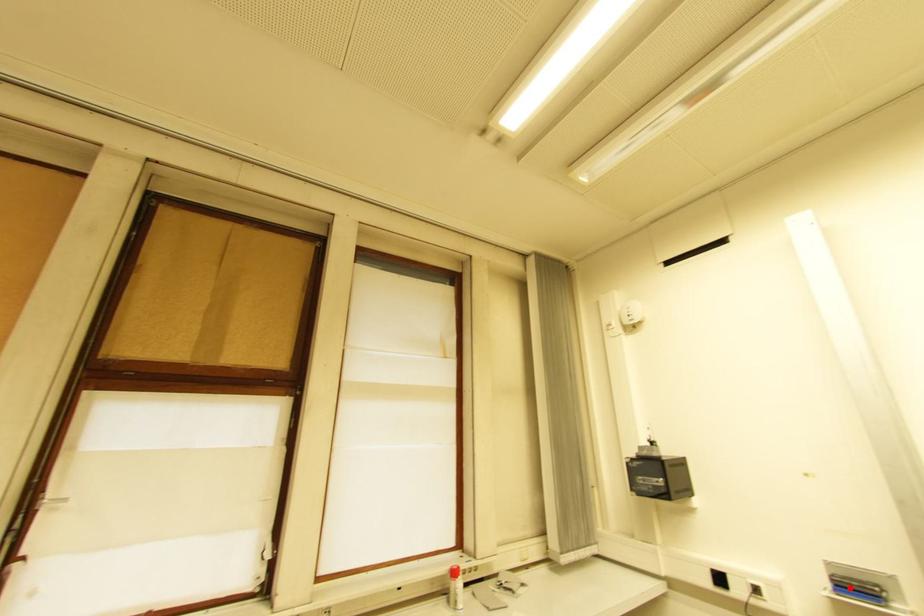
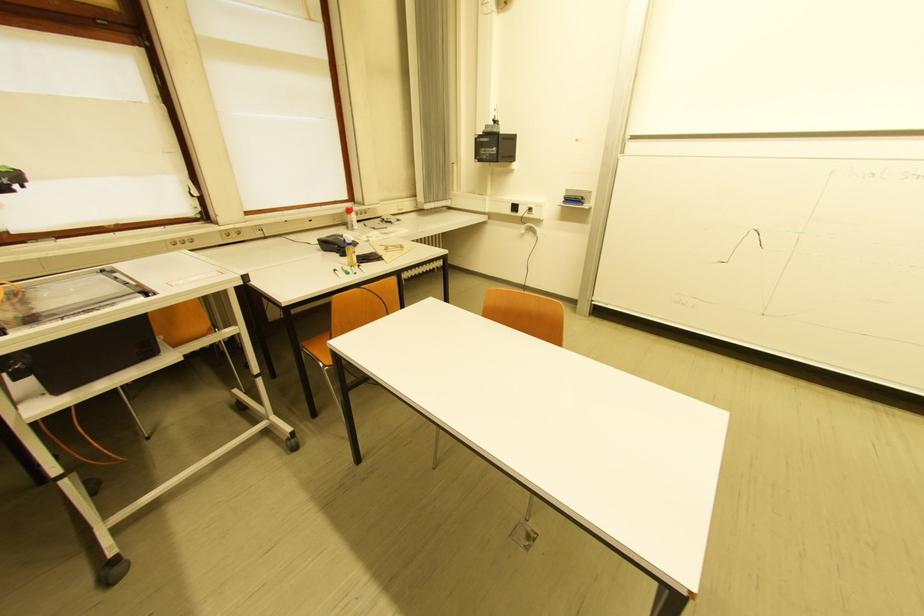
The point at the highlighted location is marked in the first image. Where is the corresponding point in the second image?

(575, 201)